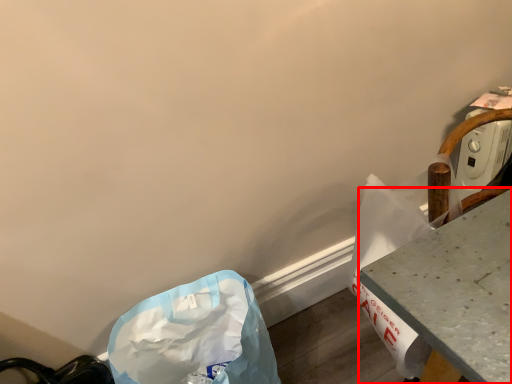
Question: Observing the image, what is the correct spatial positioning of table (annotated by the red box) in reference to plastic bag?

Choices:
 (A) left
 (B) right

Answer: (B)